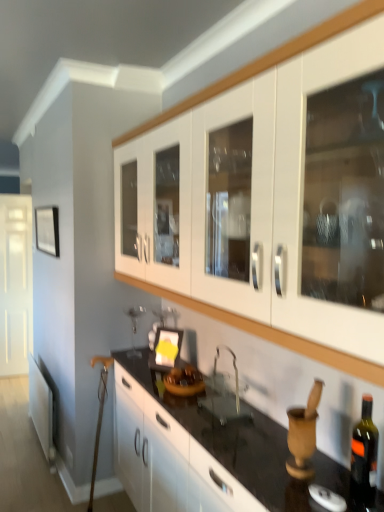
At what (x,y) coordinates should I click in order to perform the action: click on free spot above black glossy countertop at center, which ranks as the 1th cabinetry in bottom-to-top order (from a real-world perspective). Please return your answer as a coordinate pair (x, y). The height and width of the screenshot is (512, 384). Looking at the image, I should click on (233, 420).